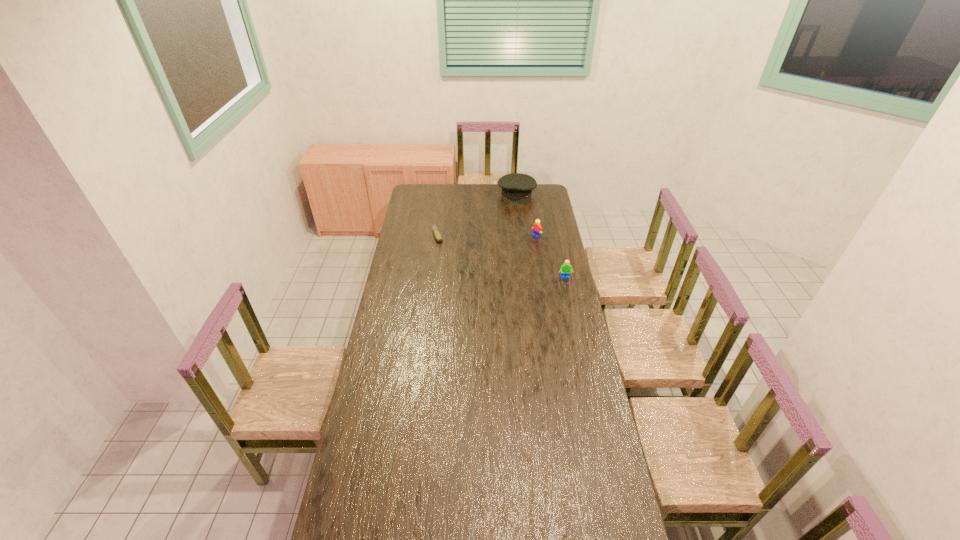
Locate an element on the screen. The width and height of the screenshot is (960, 540). vacant area located 0.400m on the front-facing side of the beret is located at coordinates (507, 242).

I want to click on blank area located on the front-facing side of the farther Lego, so click(x=502, y=259).

Locate an element on the screen. This screenshot has height=540, width=960. vacant position located 0.090m on the front-facing side of the farther Lego is located at coordinates click(523, 245).

Where is `vacant area situated on the front-facing side of the farther Lego`? vacant area situated on the front-facing side of the farther Lego is located at coordinates pyautogui.click(x=514, y=251).

This screenshot has width=960, height=540. Find the location of `object at the far edge`. object at the far edge is located at coordinates (517, 188).

You are a GUI agent. You are given a task and a screenshot of the screen. Output one action in this format:
    pyautogui.click(x=<x>, y=<y>)
    Task: Click on the beret positioned at the right edge
    The width and height of the screenshot is (960, 540).
    Given the screenshot: What is the action you would take?
    pyautogui.click(x=517, y=188)

Identify the location of object that is positioned at the far right corner. (517, 188).

Identify the location of vacant region at the far edge. This screenshot has height=540, width=960. (x=482, y=194).

The width and height of the screenshot is (960, 540). Find the location of `vacant area at the left edge of the desktop`. vacant area at the left edge of the desktop is located at coordinates (377, 413).

Image resolution: width=960 pixels, height=540 pixels. In the image, there is a desktop. Identify the location of vacant space at the right edge. (540, 219).